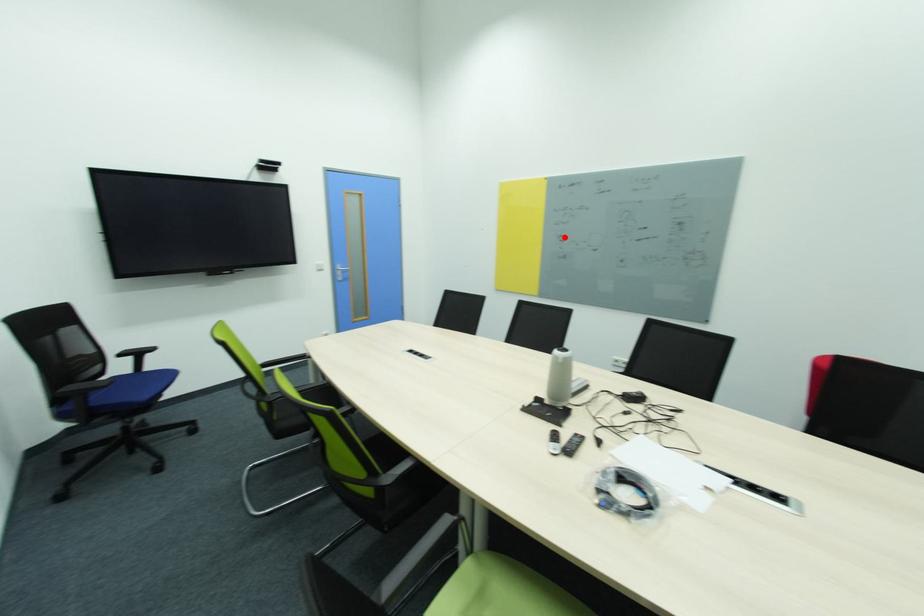
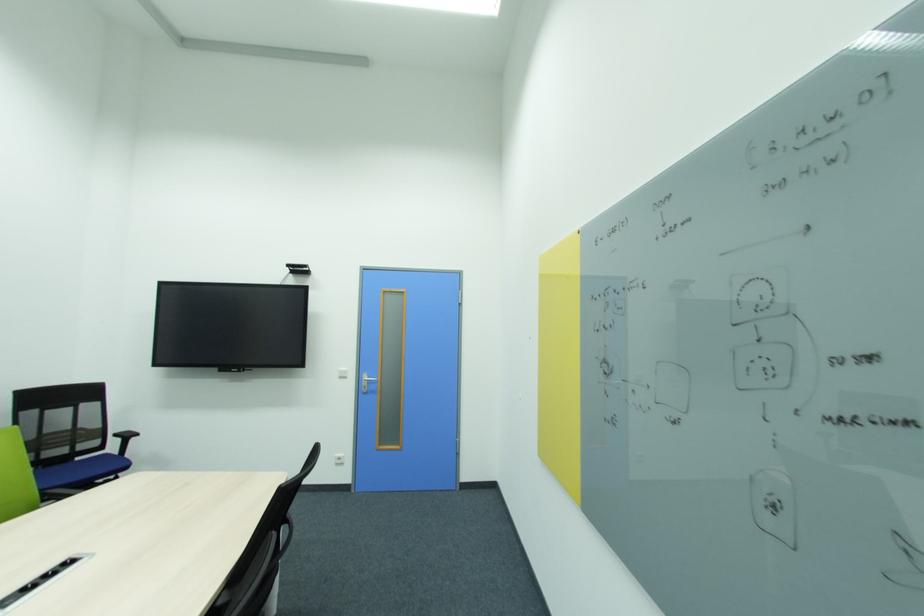
Question: I am providing you with two images of the same scene from different viewpoints. Given a red point in image1, look at the same physical point in image2. Is it:

Choices:
 (A) Closer to the viewpoint
 (B) Farther from the viewpoint

Answer: (B)